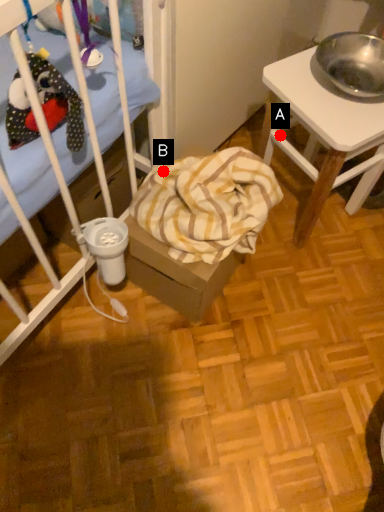
Question: Two points are circled on the image, labeled by A and B beside each circle. Which point appears closest to the camera in this image?

Choices:
 (A) A is closer
 (B) B is closer

Answer: (B)